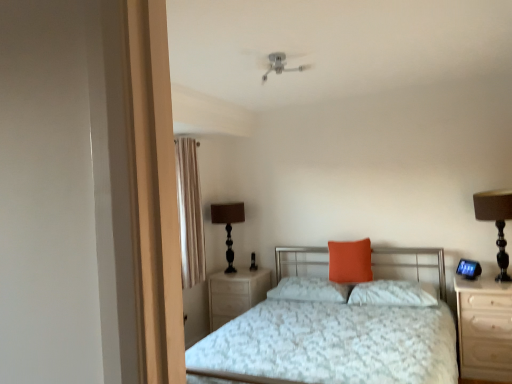
Question: Could you tell me if light wood/wooden nightstand at center, which is the second nightstand in front-to-back order, is turned towards brown fabric table lamp at right, the second table lamp when ordered from left to right?

Choices:
 (A) yes
 (B) no

Answer: (B)

Question: Can you confirm if light wood/wooden nightstand at center, the first nightstand positioned from the left, is thinner than brown fabric table lamp at right, placed as the first table lamp when sorted from right to left?

Choices:
 (A) no
 (B) yes

Answer: (A)

Question: From the image's perspective, is light wood/wooden nightstand at center, placed as the 2th nightstand when sorted from right to left, above brown fabric table lamp at right, placed as the first table lamp when sorted from right to left?

Choices:
 (A) yes
 (B) no

Answer: (B)

Question: From a real-world perspective, is light wood/wooden nightstand at center, which is the second nightstand in front-to-back order, beneath brown fabric table lamp at right, the second table lamp when ordered from left to right?

Choices:
 (A) no
 (B) yes

Answer: (B)

Question: Are light wood/wooden nightstand at center, positioned as the 1th nightstand in back-to-front order, and brown fabric table lamp at right, acting as the 2th table lamp starting from the back, beside each other?

Choices:
 (A) yes
 (B) no

Answer: (B)

Question: Is the depth of light wood/wooden nightstand at center, placed as the 2th nightstand when sorted from right to left, greater than that of brown fabric table lamp at right, the second table lamp when ordered from left to right?

Choices:
 (A) no
 (B) yes

Answer: (B)

Question: From a real-world perspective, is brown fabric table lamp at right, placed as the first table lamp when sorted from right to left, located beneath white textured bed at center?

Choices:
 (A) no
 (B) yes

Answer: (A)

Question: Does brown fabric table lamp at right, placed as the first table lamp when sorted from right to left, have a greater height compared to white textured bed at center?

Choices:
 (A) no
 (B) yes

Answer: (A)

Question: Does brown fabric table lamp at right, placed as the first table lamp when sorted from right to left, appear on the right side of white textured bed at center?

Choices:
 (A) no
 (B) yes

Answer: (B)

Question: Is brown fabric table lamp at right, the second table lamp when ordered from left to right, thinner than white textured bed at center?

Choices:
 (A) yes
 (B) no

Answer: (A)

Question: From the image's perspective, is brown fabric table lamp at right, the first table lamp in the front-to-back sequence, on top of white textured bed at center?

Choices:
 (A) yes
 (B) no

Answer: (A)

Question: Is white textured bed at center located within brown fabric table lamp at right, the second table lamp when ordered from left to right?

Choices:
 (A) no
 (B) yes

Answer: (A)

Question: Is beige fabric curtain at left to the right of orange fabric pillow at center, acting as the 1th pillow starting from the right, from the viewer's perspective?

Choices:
 (A) yes
 (B) no

Answer: (B)